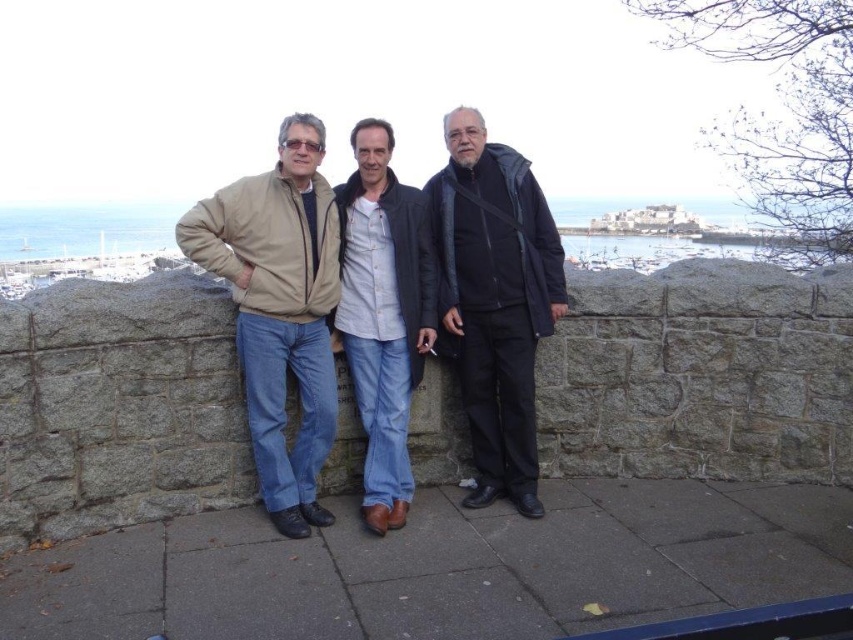
Between point (456, 156) and point (267, 262), which one is positioned in front?

Point (267, 262) is in front.

Can you confirm if matte beige jacket at center is positioned to the right of beige fabric jacket at left?

Indeed, matte beige jacket at center is positioned on the right side of beige fabric jacket at left.

Is point (427, 308) farther from camera compared to point (257, 413)?

Yes, point (427, 308) is farther from viewer.

The width and height of the screenshot is (853, 640). Find the location of `matte beige jacket at center`. matte beige jacket at center is located at coordinates (386, 316).

Does matte beige jacket at center appear over light blue denim jeans at center?

Yes.

Does point (404, 282) lie in front of point (413, 349)?

Yes, point (404, 282) is in front of point (413, 349).

At what (x,y) coordinates should I click in order to perform the action: click on matte beige jacket at center. Please return your answer as a coordinate pair (x, y). The image size is (853, 640). Looking at the image, I should click on (386, 316).

Which is more to the left, beige fabric jacket at left or light blue denim jeans at center?

Positioned to the left is beige fabric jacket at left.

You are a GUI agent. You are given a task and a screenshot of the screen. Output one action in this format:
    pyautogui.click(x=<x>, y=<y>)
    Task: Click on the beige fabric jacket at left
    Image resolution: width=853 pixels, height=640 pixels.
    Given the screenshot: What is the action you would take?
    click(x=279, y=308)